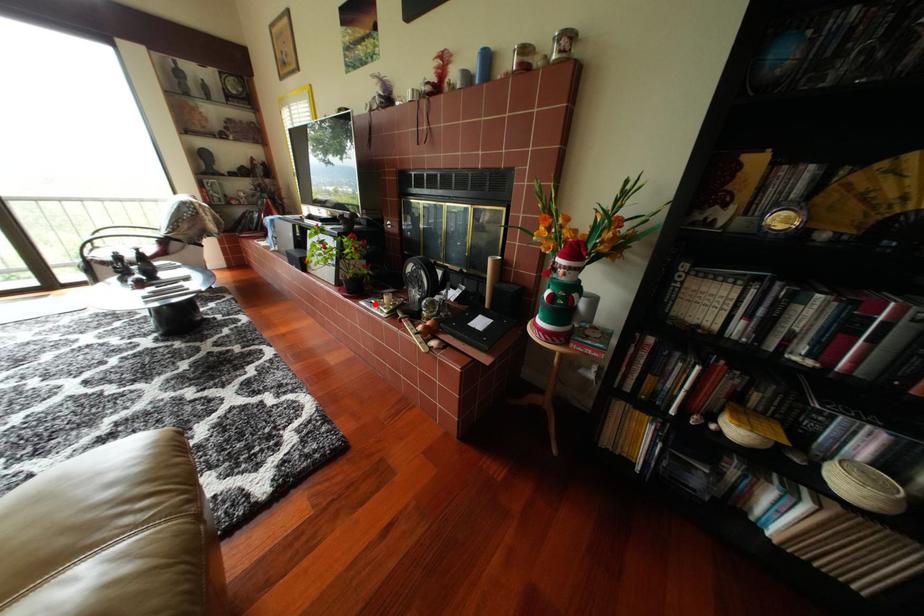
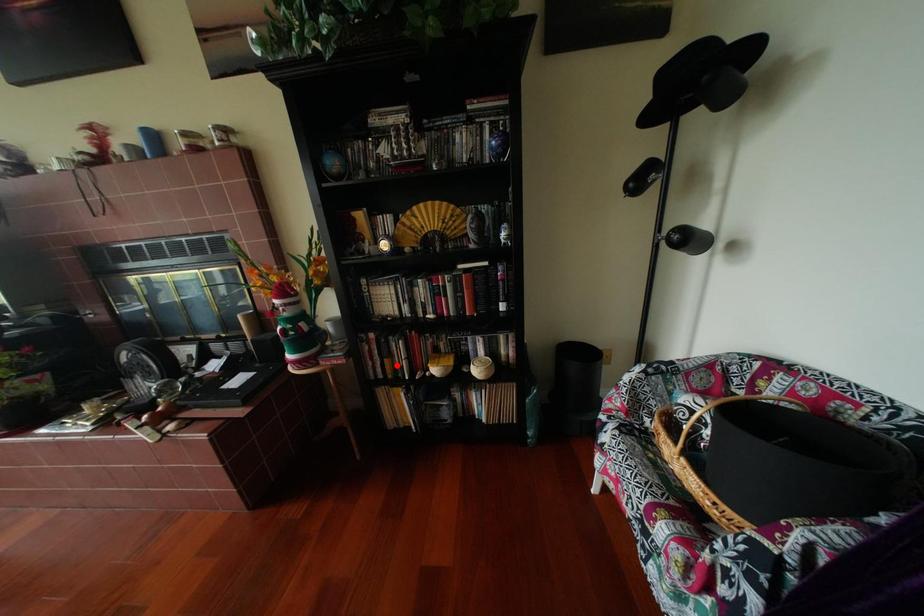
I am providing you with two images of the same scene from different viewpoints. A red point is marked on the first image and another point is marked on the second image. Is the red point in image1 aligned with the point shown in image2?

No